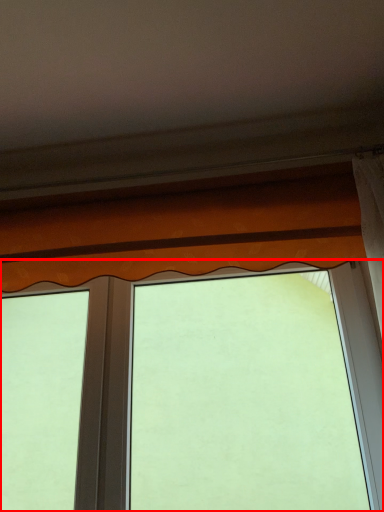
Question: From the image's perspective, where is window (annotated by the red box) located in relation to curtain in the image?

Choices:
 (A) below
 (B) above

Answer: (A)